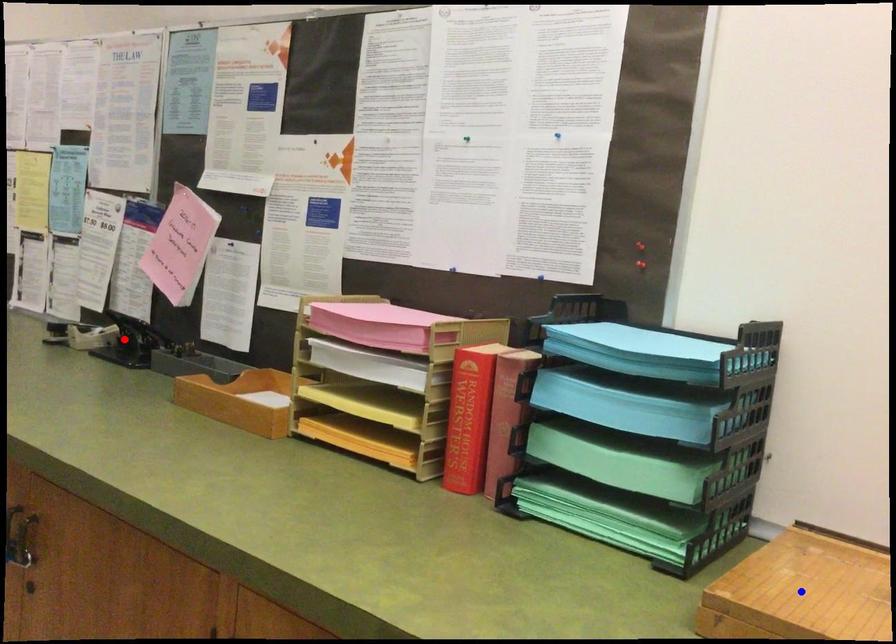
Question: In the image, two points are highlighted. Which point is nearer to the camera? Reply with the corresponding letter.

Choices:
 (A) blue point
 (B) red point

Answer: (A)